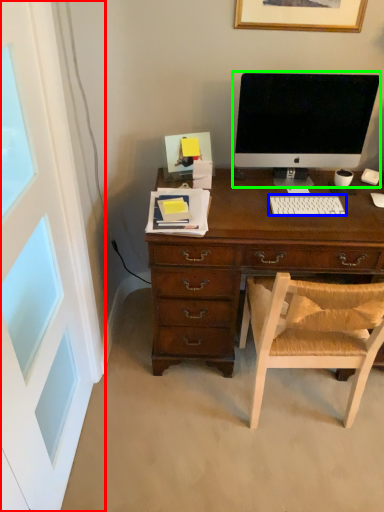
Question: Which object is positioned closest to screen door (highlighted by a red box)? Select from computer keyboard (highlighted by a blue box) and computer monitor (highlighted by a green box).

Choices:
 (A) computer keyboard
 (B) computer monitor

Answer: (A)